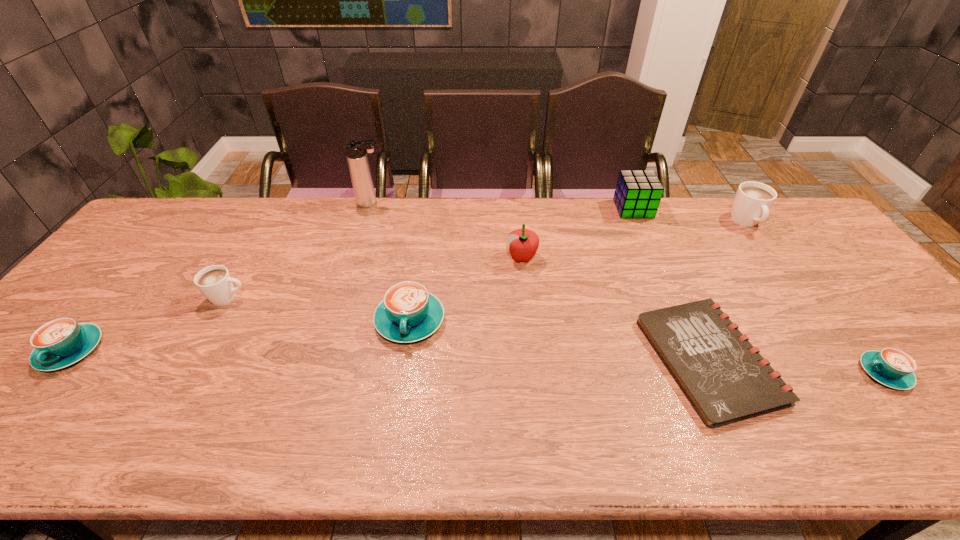
Where is `vacant area between the left white cappuccino and the tallest object`? The height and width of the screenshot is (540, 960). vacant area between the left white cappuccino and the tallest object is located at coordinates click(300, 251).

The image size is (960, 540). I want to click on free area in between the second shortest cappuccino and the biggest turquoise cappuccino, so click(241, 335).

Identify the location of blank region between the nearer white cappuccino and the thermos bottle. (300, 251).

Where is `empty space between the second shortest object and the second shortest cappuccino`? This screenshot has width=960, height=540. empty space between the second shortest object and the second shortest cappuccino is located at coordinates (478, 362).

Locate an element on the screen. unoccupied position between the third cappuccino from right to left and the second smallest turquoise cappuccino is located at coordinates (241, 335).

The image size is (960, 540). Identify the location of free space between the second cappuccino from left to right and the leftmost object. (150, 324).

The height and width of the screenshot is (540, 960). Identify the location of empty location between the apple and the notebook. (615, 309).

Locate an element on the screen. free space that is in between the fourth object from left to right and the fourth tallest cappuccino is located at coordinates (241, 335).

Identify which object is the second nearest to the second shortest object. Please provide its 2D coordinates. Your answer should be formatted as a tuple, i.e. [(x, y)], where the tuple contains the x and y coordinates of a point satisfying the conditions above.

[(751, 205)]

Locate an element on the screen. The width and height of the screenshot is (960, 540). object that is the sixth closest one to the red apple is located at coordinates (215, 282).